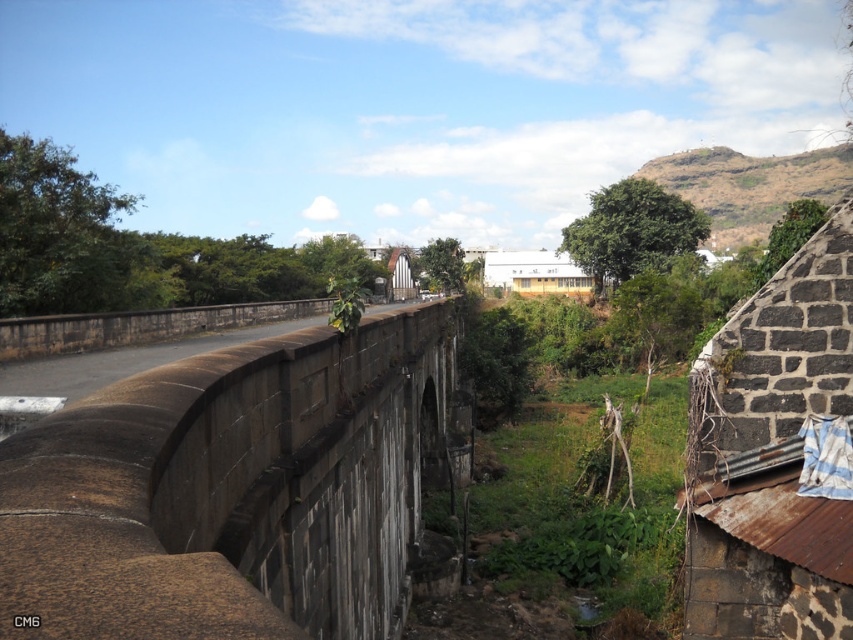
You are a photographer planning to capture a wide shot of the brown stone bridge at center and the dark gray stone wall at upper right. Given their sizes, which one should you focus on to ensure both are visible in the frame without cropping?

The brown stone bridge at center is bigger than the dark gray stone wall at upper right, so you should focus on the brown stone bridge at center to ensure both are visible in the frame without cropping.

You are a photographer planning to capture the brown stone bridge at center and the dark gray stone wall at upper right in a single shot. Based on their sizes in the image, which object would appear smaller in the final photograph?

The brown stone bridge at center appears smaller in the photograph because it is shorter than the dark gray stone wall at upper right.